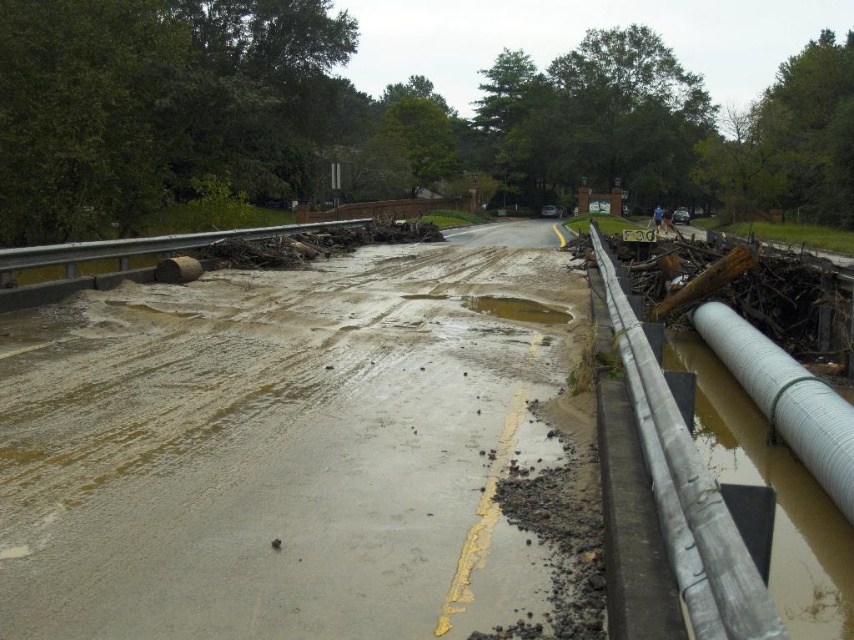
Who is positioned more to the left, muddy concrete road at center or white corrugated pipe at right?

muddy concrete road at center is more to the left.

Is muddy concrete road at center closer to the viewer compared to white corrugated pipe at right?

Yes, muddy concrete road at center is in front of white corrugated pipe at right.

What do you see at coordinates (279, 451) in the screenshot?
I see `muddy concrete road at center` at bounding box center [279, 451].

Locate an element on the screen. This screenshot has height=640, width=854. muddy concrete road at center is located at coordinates (279, 451).

Measure the distance from muddy concrete road at center to brown mud puddle at center.

muddy concrete road at center is 8.42 feet away from brown mud puddle at center.

Is muddy concrete road at center in front of brown mud puddle at center?

Yes.

Describe the element at coordinates (279, 451) in the screenshot. The height and width of the screenshot is (640, 854). I see `muddy concrete road at center` at that location.

Locate an element on the screen. Image resolution: width=854 pixels, height=640 pixels. muddy concrete road at center is located at coordinates (279, 451).

Where is `white corrugated pipe at right`? The width and height of the screenshot is (854, 640). white corrugated pipe at right is located at coordinates (787, 400).

Is white corrugated pipe at right to the right of brown mud puddle at center from the viewer's perspective?

Correct, you'll find white corrugated pipe at right to the right of brown mud puddle at center.

The image size is (854, 640). Describe the element at coordinates (787, 400) in the screenshot. I see `white corrugated pipe at right` at that location.

The height and width of the screenshot is (640, 854). Find the location of `white corrugated pipe at right`. white corrugated pipe at right is located at coordinates (787, 400).